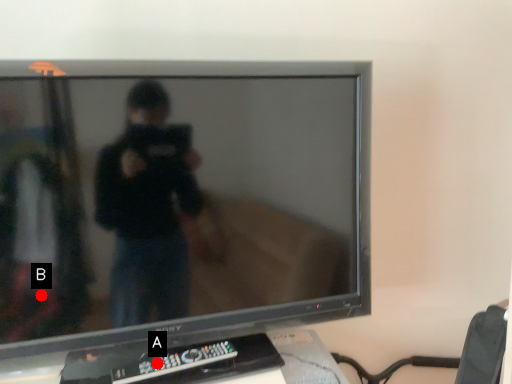
Question: Two points are circled on the image, labeled by A and B beside each circle. Which of the following is the closest to the observer?

Choices:
 (A) A is closer
 (B) B is closer

Answer: (B)